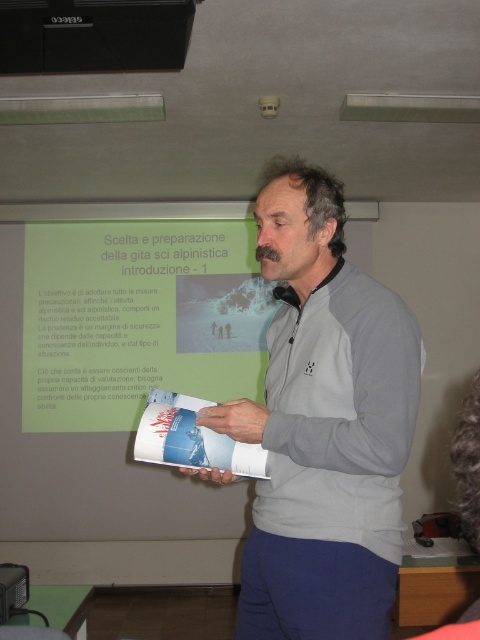
Question: Among these points, which one is nearest to the camera?

Choices:
 (A) (368, 422)
 (B) (40, 36)

Answer: (A)

Question: Which point appears farthest from the camera in this image?

Choices:
 (A) (240, 636)
 (B) (0, 3)

Answer: (B)

Question: Does gray fleece jacket at center lie behind black plastic projector at upper center?

Choices:
 (A) no
 (B) yes

Answer: (A)

Question: Is gray fleece jacket at center wider than black plastic projector at upper center?

Choices:
 (A) yes
 (B) no

Answer: (B)

Question: Is gray fleece jacket at center bigger than black plastic projector at upper center?

Choices:
 (A) no
 (B) yes

Answer: (B)